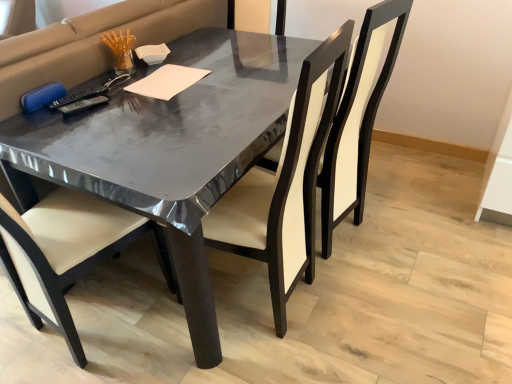
Where is `free location to the right of white paper at center`? This screenshot has height=384, width=512. free location to the right of white paper at center is located at coordinates (229, 81).